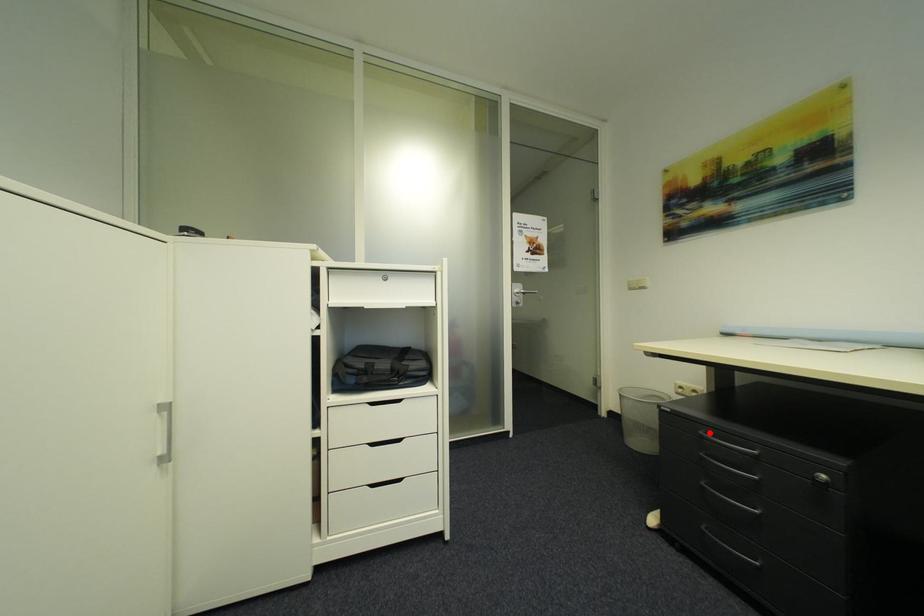
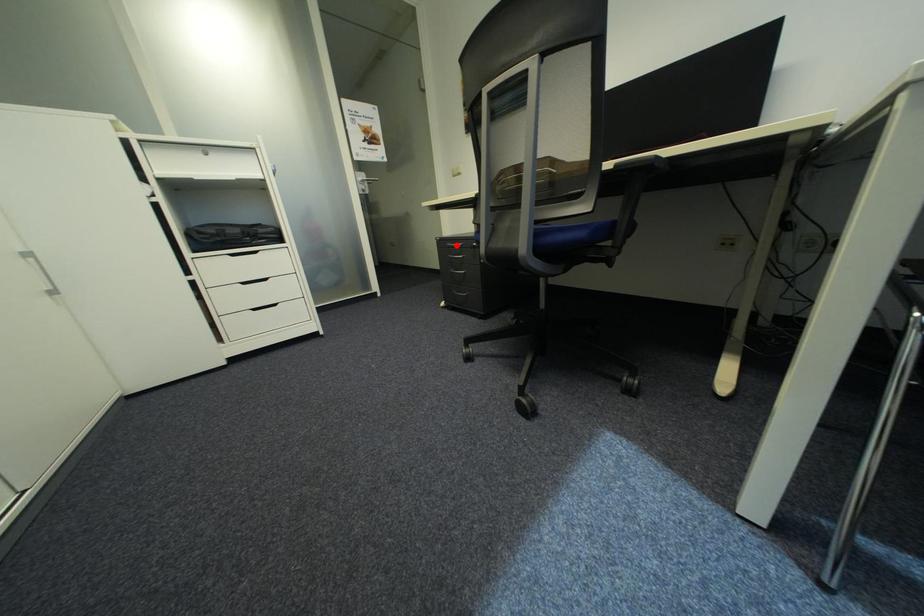
I am providing you with two images of the same scene from different viewpoints. A red point is marked on the first image and another point is marked on the second image. Is the marked point in image1 the same physical position as the marked point in image2?

Yes